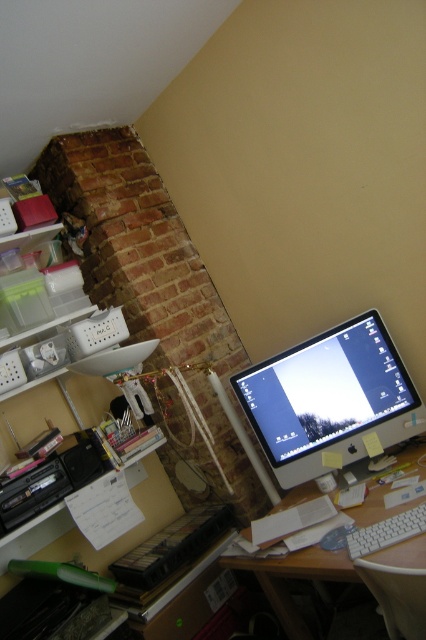
You are organizing your desk and need to place a new mouse that requires 30 cm of space. Given the white plastic computer desk at center and the white plastic keyboard at lower right, which object has enough space to accommodate the mouse?

The white plastic computer desk at center is bigger than the white plastic keyboard at lower right, so it has enough space to accommodate the mouse.